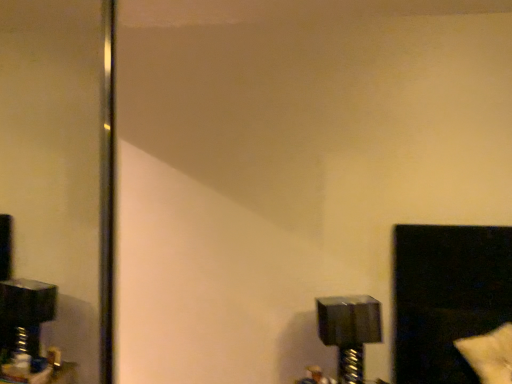
This screenshot has width=512, height=384. I want to click on black glossy window at lower right, so click(446, 297).

Consider the image. From the image's perspective, which object appears higher, white fluffy pillow at lower right or black plastic mirror at left?

From the image's view, black plastic mirror at left is above.

Which of these two, white fluffy pillow at lower right or black plastic mirror at left, is thinner?

With smaller width is black plastic mirror at left.

Where is `mirror on the left of white fluffy pillow at lower right`? The height and width of the screenshot is (384, 512). mirror on the left of white fluffy pillow at lower right is located at coordinates (60, 160).

From a real-world perspective, which is physically above, white fluffy pillow at lower right or metallic silver bolt at lower right?

white fluffy pillow at lower right, from a real-world perspective.

Considering the sizes of white fluffy pillow at lower right and metallic silver bolt at lower right in the image, is white fluffy pillow at lower right wider or thinner than metallic silver bolt at lower right?

Clearly, white fluffy pillow at lower right has more width compared to metallic silver bolt at lower right.

Can you tell me how much white fluffy pillow at lower right and metallic silver bolt at lower right differ in facing direction?

The angle between the facing direction of white fluffy pillow at lower right and the facing direction of metallic silver bolt at lower right is 4.25 degrees.

Does point (499, 364) lie behind point (362, 321)?

No, it is in front of (362, 321).

In the scene shown: Is black plastic mirror at left behind metallic silver bolt at lower right?

No, it is in front of metallic silver bolt at lower right.

Between black plastic mirror at left and metallic silver bolt at lower right, which one has larger width?

metallic silver bolt at lower right.

Would you say black plastic mirror at left is outside metallic silver bolt at lower right?

Yes, black plastic mirror at left is not within metallic silver bolt at lower right.

Can you confirm if white fluffy pillow at lower right is thinner than black glossy window at lower right?

Indeed, white fluffy pillow at lower right has a lesser width compared to black glossy window at lower right.

Is white fluffy pillow at lower right facing away from black glossy window at lower right?

Yes, white fluffy pillow at lower right is facing away from black glossy window at lower right.

Considering the relative sizes of white fluffy pillow at lower right and black glossy window at lower right in the image provided, is white fluffy pillow at lower right bigger than black glossy window at lower right?

No.

Does white fluffy pillow at lower right have a greater height compared to black glossy window at lower right?

Incorrect, the height of white fluffy pillow at lower right is not larger of that of black glossy window at lower right.

Is metallic silver bolt at lower right looking in the opposite direction of white fluffy pillow at lower right?

No, white fluffy pillow at lower right is not at the back of metallic silver bolt at lower right.

Is metallic silver bolt at lower right shorter than white fluffy pillow at lower right?

No.

Is metallic silver bolt at lower right bigger than white fluffy pillow at lower right?

Correct, metallic silver bolt at lower right is larger in size than white fluffy pillow at lower right.

Is there a large distance between metallic silver bolt at lower right and white fluffy pillow at lower right?

No, metallic silver bolt at lower right is not far from white fluffy pillow at lower right.

Is black glossy window at lower right aimed at black plastic mirror at left?

No, black glossy window at lower right is not oriented towards black plastic mirror at left.

Is black glossy window at lower right shorter than black plastic mirror at left?

Yes, black glossy window at lower right is shorter than black plastic mirror at left.

Can you see black glossy window at lower right touching black plastic mirror at left?

No, black glossy window at lower right is not with black plastic mirror at left.

Which object is closer to the camera, black plastic mirror at left or white fluffy pillow at lower right?

Positioned in front is white fluffy pillow at lower right.

Is black plastic mirror at left positioned with its back to white fluffy pillow at lower right?

No, black plastic mirror at left is not facing the opposite direction of white fluffy pillow at lower right.

From a real-world perspective, who is located lower, black plastic mirror at left or white fluffy pillow at lower right?

white fluffy pillow at lower right.

Identify the location of pillow below the black plastic mirror at left (from the image's perspective). (489, 354).

The height and width of the screenshot is (384, 512). Identify the location of pillow that appears in front of the metallic silver bolt at lower right. (489, 354).

When comparing their distances from metallic silver bolt at lower right, does black glossy window at lower right or white fluffy pillow at lower right seem further?

white fluffy pillow at lower right lies further to metallic silver bolt at lower right than the other object.

When comparing their distances from black plastic mirror at left, does black glossy window at lower right or white fluffy pillow at lower right seem closer?

black glossy window at lower right.

Estimate the real-world distances between objects in this image. Which object is further from black glossy window at lower right, white fluffy pillow at lower right or black plastic mirror at left?

black plastic mirror at left.

From the image, which object appears to be nearer to black plastic mirror at left, white fluffy pillow at lower right or black glossy window at lower right?

black glossy window at lower right is closer to black plastic mirror at left.

Which object lies nearer to the anchor point black plastic mirror at left, metallic silver bolt at lower right or black glossy window at lower right?

The object closer to black plastic mirror at left is metallic silver bolt at lower right.

When comparing their distances from white fluffy pillow at lower right, does black glossy window at lower right or metallic silver bolt at lower right seem further?

metallic silver bolt at lower right is positioned further to the anchor white fluffy pillow at lower right.

When comparing their distances from metallic silver bolt at lower right, does white fluffy pillow at lower right or black glossy window at lower right seem further?

Based on the image, white fluffy pillow at lower right appears to be further to metallic silver bolt at lower right.

Estimate the real-world distances between objects in this image. Which object is further from black glossy window at lower right, black plastic mirror at left or white fluffy pillow at lower right?

black plastic mirror at left is further to black glossy window at lower right.

The image size is (512, 384). I want to click on lamp between black plastic mirror at left and white fluffy pillow at lower right, so click(349, 331).

What are the coordinates of `lamp located between black plastic mirror at left and black glossy window at lower right in the left-right direction` in the screenshot? It's located at (349, 331).

Where is `window between metallic silver bolt at lower right and white fluffy pillow at lower right from left to right`? Image resolution: width=512 pixels, height=384 pixels. window between metallic silver bolt at lower right and white fluffy pillow at lower right from left to right is located at coordinates (446, 297).

I want to click on window located between black plastic mirror at left and white fluffy pillow at lower right in the left-right direction, so click(x=446, y=297).